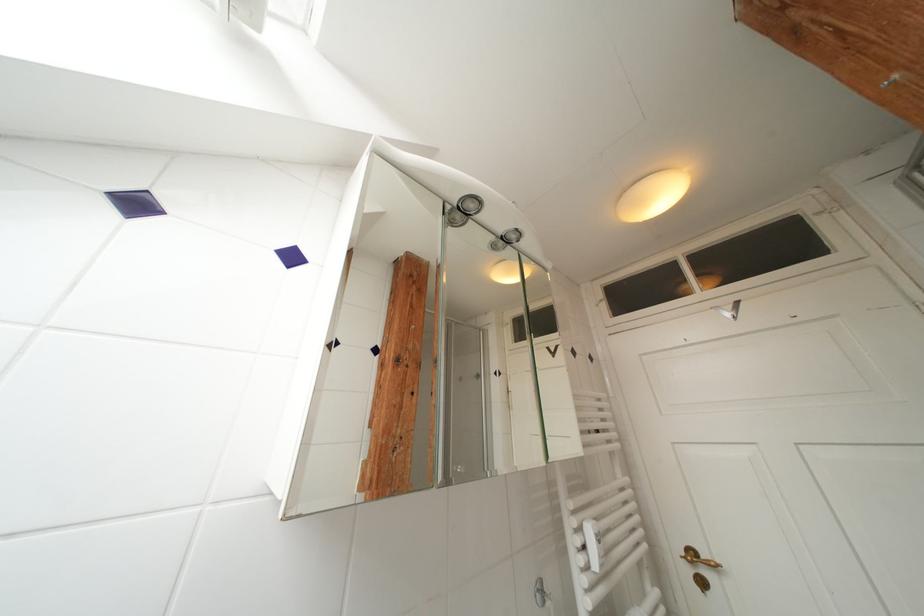
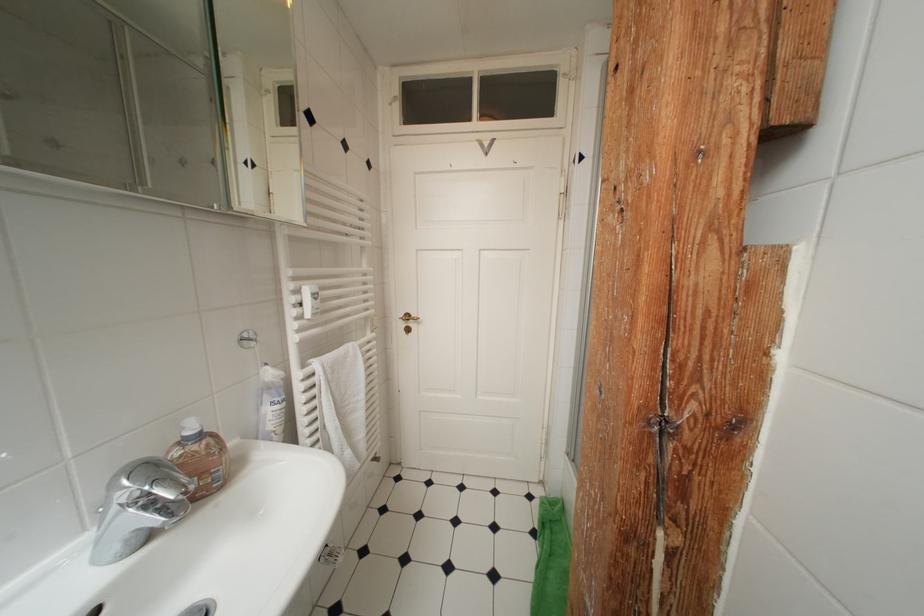
In the second image, find the point that corresponds to point (699, 557) in the first image.

(415, 320)